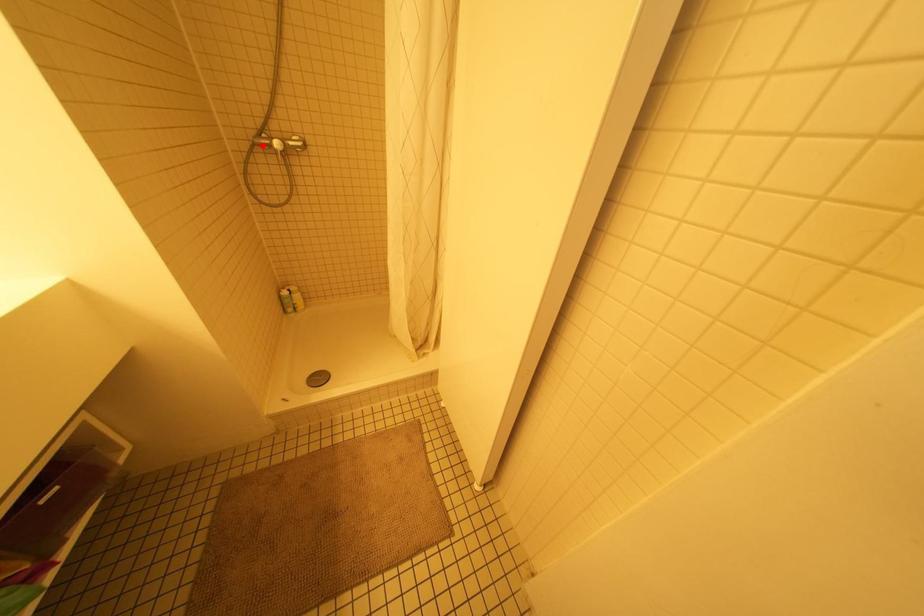
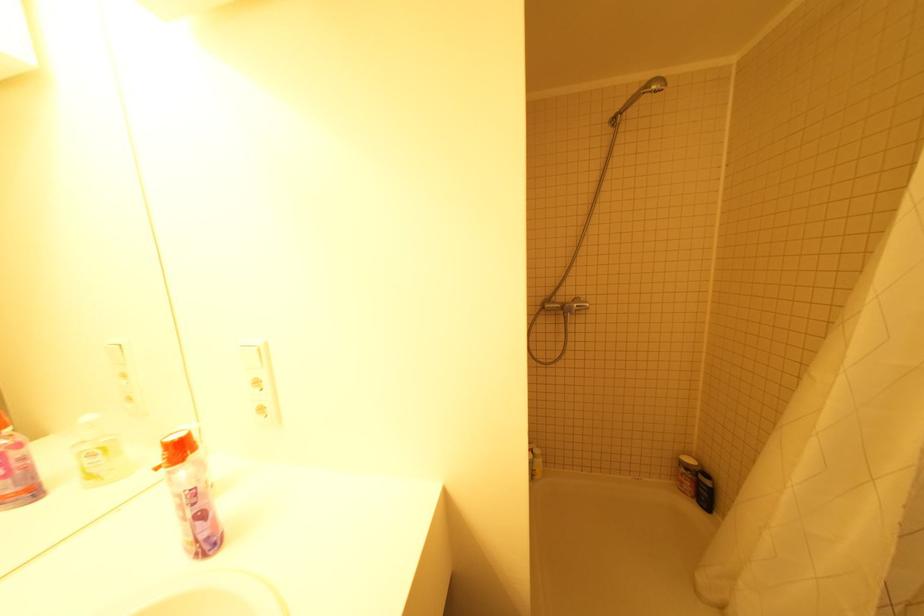
Find the pixel in the second image that matches the highlighted location in the first image.

(550, 310)